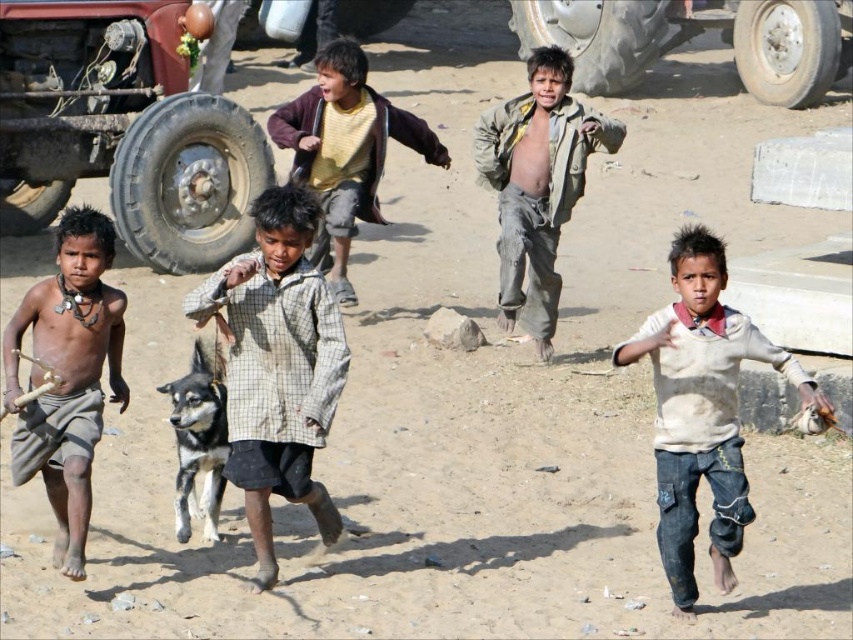
Question: Which object appears farthest from the camera in this image?

Choices:
 (A) brown textured cloth at left
 (B) yellow cotton shirt at center

Answer: (B)

Question: Does rubber/rough tire at center-left have a lesser width compared to gray rubber tire at upper right?

Choices:
 (A) yes
 (B) no

Answer: (B)

Question: Is white cotton shirt at center to the left of rubber tire at upper center from the viewer's perspective?

Choices:
 (A) no
 (B) yes

Answer: (B)

Question: Observing the image, what is the correct spatial positioning of checkered fabric shirt at center in reference to rubber tire at left?

Choices:
 (A) below
 (B) above

Answer: (A)

Question: Estimate the real-world distances between objects in this image. Which object is closer to the rubber tire at upper center?

Choices:
 (A) dirty gray pants at center
 (B) rubber tire at left
 (C) gray rubber tire at upper right

Answer: (C)

Question: Among these objects, which one is nearest to the camera?

Choices:
 (A) brown textured cloth at left
 (B) rubber tire at upper center

Answer: (A)